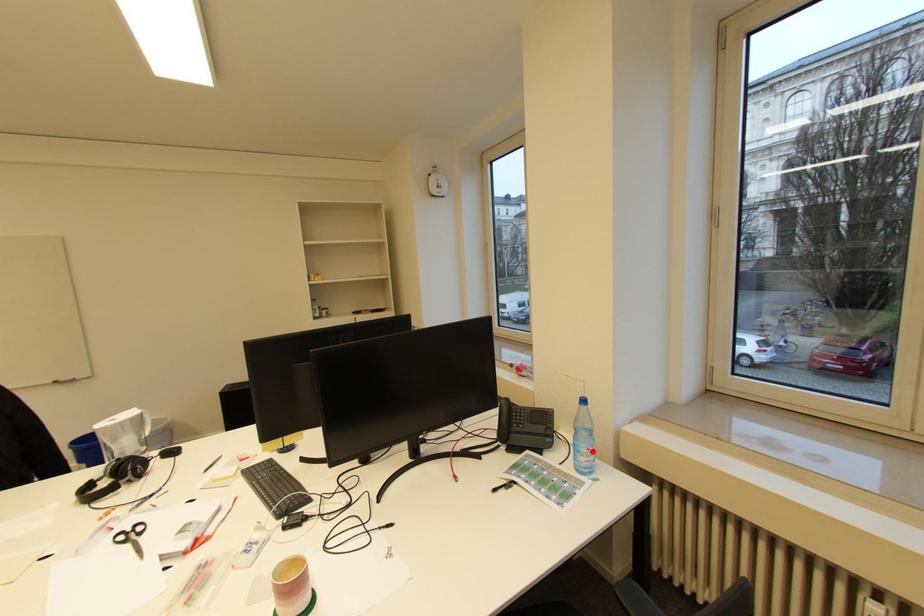
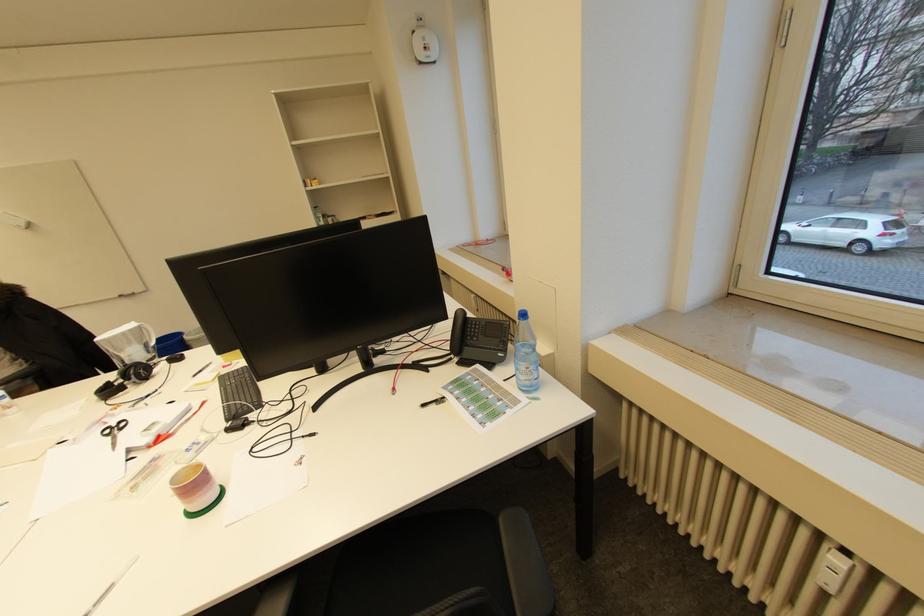
In the second image, find the point that corresponds to the highlighted location in the first image.

(531, 370)